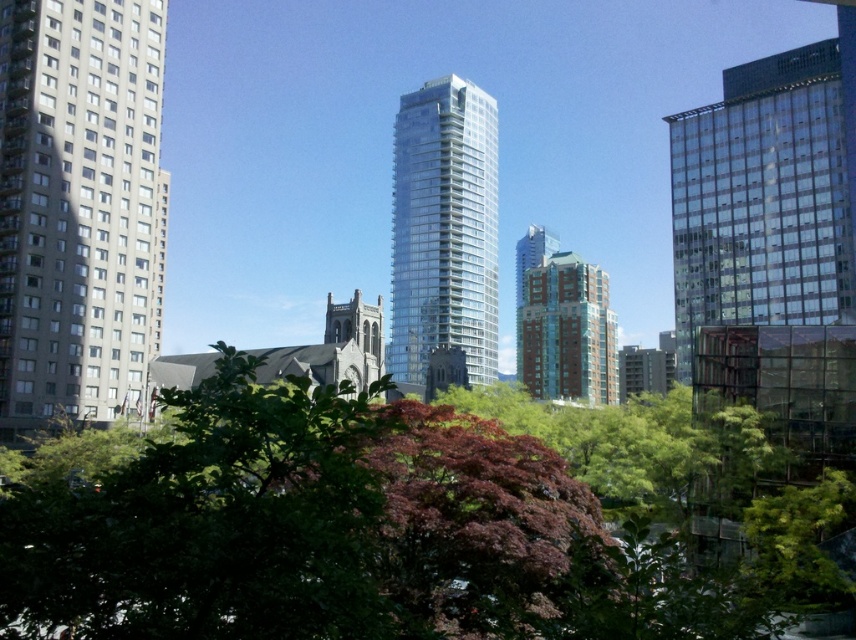
You are a city planner assessing the distance between two clear glass structures in the urban scene. Given that the minimum required distance between such buildings for fire safety regulations is 50 meters, can the clear glass building at upper right and the clear glass tower at center comply with the safety standards?

The clear glass building at upper right and the clear glass tower at center are 55.73 meters apart, which exceeds the 50 meter requirement, so they comply with the fire safety regulations.

You are standing in the urban landscape scene and want to take a photo of the clear glass building at upper right. If your camera has a maximum focus range of 50 meters, will you need to adjust your position to capture it clearly?

The clear glass building at upper right is 57.24 meters away from the viewer. Since the camera can only focus up to 50 meters, you need to move closer to ensure the clear glass building at upper right is within the camera range.